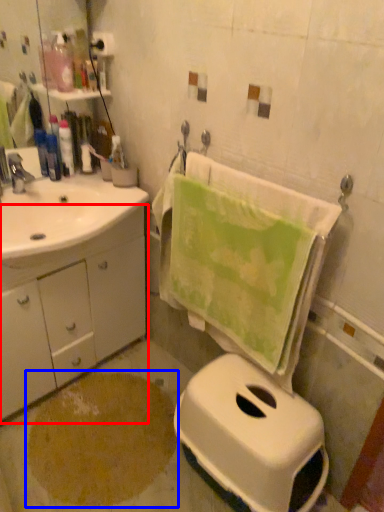
Question: Among these objects, which one is farthest to the camera, bathroom cabinet (highlighted by a red box) or powder (highlighted by a blue box)?

Choices:
 (A) bathroom cabinet
 (B) powder

Answer: (B)